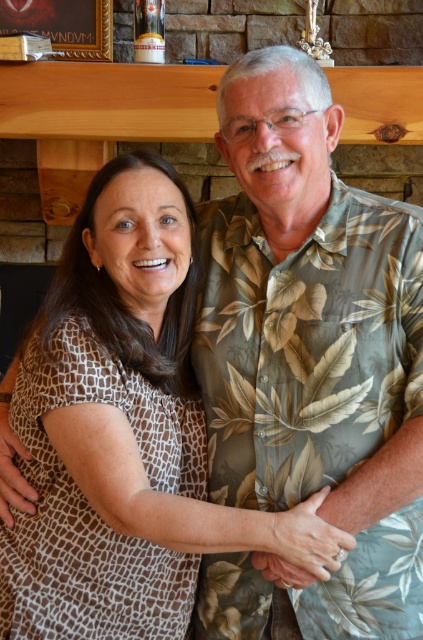
The width and height of the screenshot is (423, 640). Describe the element at coordinates (129, 275) in the screenshot. I see `brown textured blouse at center` at that location.

Can you confirm if brown textured blouse at center is wider than wooden picture frame at upper center?

Yes.

The height and width of the screenshot is (640, 423). I want to click on brown textured blouse at center, so click(129, 275).

You are a GUI agent. You are given a task and a screenshot of the screen. Output one action in this format:
    pyautogui.click(x=<x>, y=<y>)
    Task: Click on the brown textured blouse at center
    
    Given the screenshot: What is the action you would take?
    pyautogui.click(x=129, y=275)